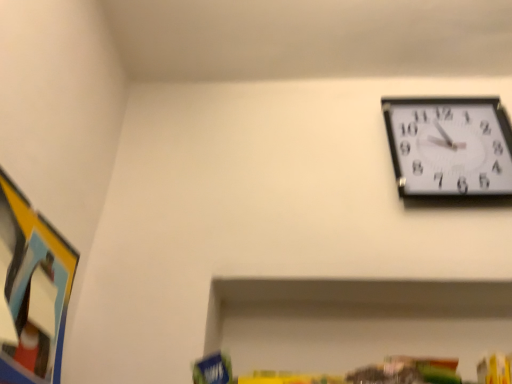
Locate an element on the screen. Image resolution: width=512 pixels, height=384 pixels. white plastic wall clock at upper right is located at coordinates (449, 146).

What do you see at coordinates (449, 146) in the screenshot?
I see `white plastic wall clock at upper right` at bounding box center [449, 146].

Locate an element on the screen. The image size is (512, 384). white plastic wall clock at upper right is located at coordinates (449, 146).